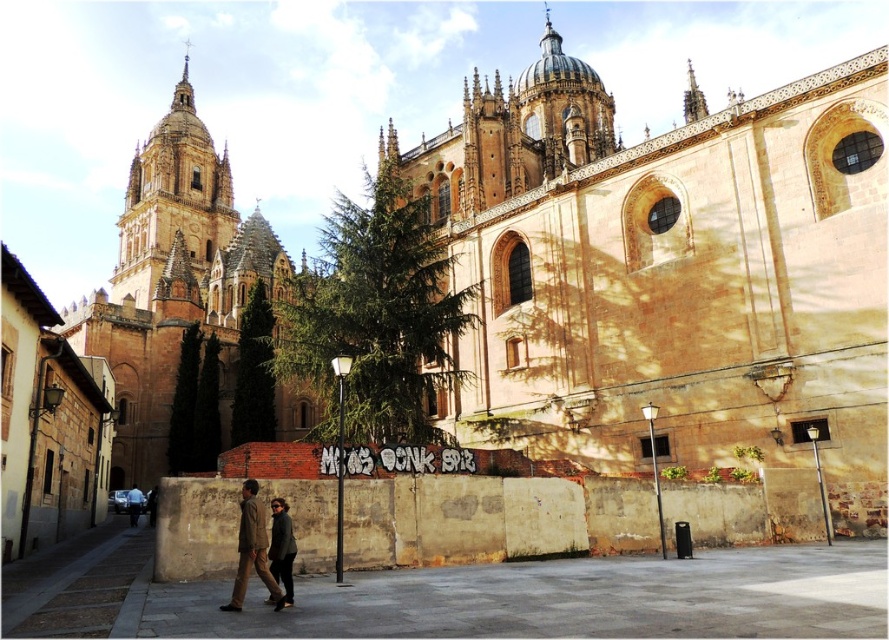
Question: Can you confirm if beige stone church at center is smaller than brown stone church at upper left?

Choices:
 (A) no
 (B) yes

Answer: (B)

Question: Which object is positioned farthest from the beige stone church at center?

Choices:
 (A) dark gray fabric jacket at lower center
 (B) dark brown leather jacket at lower center

Answer: (B)

Question: Among these objects, which one is farthest from the camera?

Choices:
 (A) dark gray fabric jacket at lower center
 (B) beige stone church at center
 (C) brown stone church at upper left
 (D) dark brown leather jacket at lower left

Answer: (C)

Question: Does brown stone church at upper left have a smaller size compared to dark brown leather jacket at lower center?

Choices:
 (A) yes
 (B) no

Answer: (B)

Question: Which point is closer to the camera taking this photo?

Choices:
 (A) (526, 371)
 (B) (291, 598)

Answer: (B)

Question: Observing the image, what is the correct spatial positioning of beige stone church at center in reference to dark brown leather jacket at lower center?

Choices:
 (A) left
 (B) right

Answer: (B)